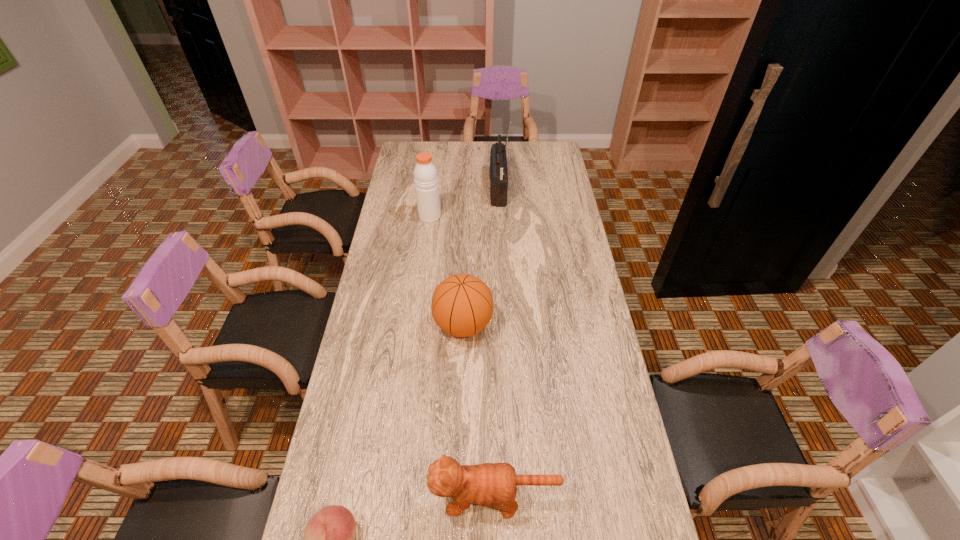
Locate an element on the screen. The height and width of the screenshot is (540, 960). the tallest object is located at coordinates (498, 160).

You are a GUI agent. You are given a task and a screenshot of the screen. Output one action in this format:
    pyautogui.click(x=<x>, y=<y>)
    Task: Click on the fourth object from right to left
    The image size is (960, 540).
    Given the screenshot: What is the action you would take?
    pyautogui.click(x=425, y=173)

Identify the location of the fourth shortest object. This screenshot has width=960, height=540. (425, 173).

This screenshot has width=960, height=540. Identify the location of basketball. (462, 305).

The width and height of the screenshot is (960, 540). Identify the location of cat. (487, 484).

Find the location of `free space located 0.320m on the front-facing side of the radio receiver`. free space located 0.320m on the front-facing side of the radio receiver is located at coordinates (420, 190).

At what (x,y) coordinates should I click in order to perform the action: click on vacant area situated on the front-facing side of the radio receiver. Please return your answer as a coordinate pair (x, y). The width and height of the screenshot is (960, 540). Looking at the image, I should click on (472, 190).

I want to click on vacant space located on the front-facing side of the radio receiver, so click(422, 190).

Find the location of a particular element. vacant region located on the back of the fourth shortest object is located at coordinates (433, 189).

The height and width of the screenshot is (540, 960). Find the location of `free space located 0.310m on the back of the third farthest object`. free space located 0.310m on the back of the third farthest object is located at coordinates (466, 244).